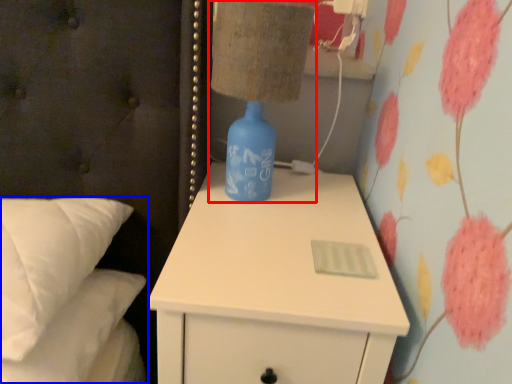
Question: Which point is further to the camera, table lamp (highlighted by a red box) or bed (highlighted by a blue box)?

Choices:
 (A) table lamp
 (B) bed

Answer: (A)